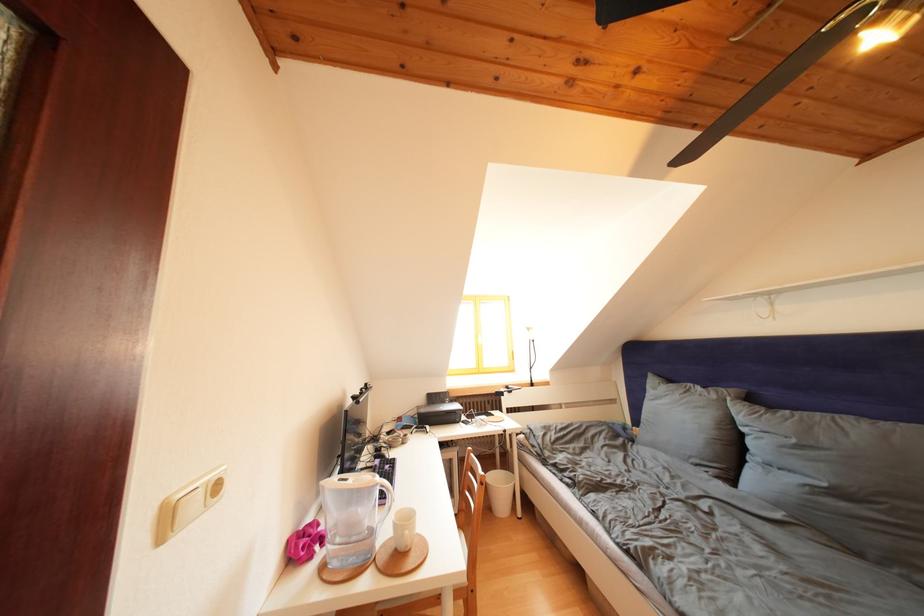
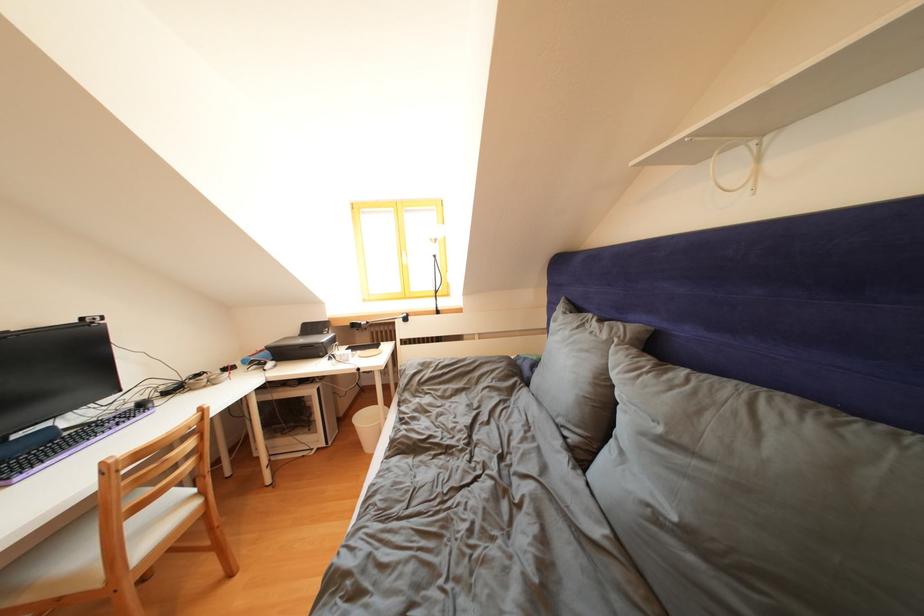
Where in the second image is the point corresponding to point (722, 402) from the first image?

(612, 341)